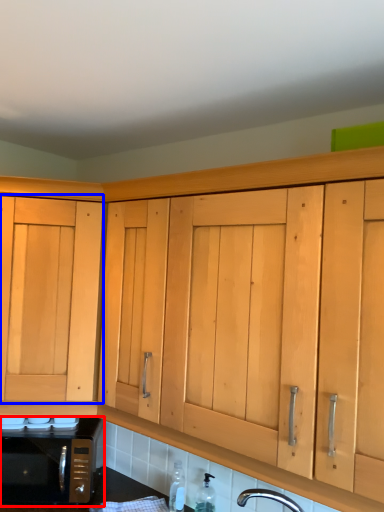
Question: Which point is closer to the camera, microwave oven (highlighted by a red box) or cabinetry (highlighted by a blue box)?

Choices:
 (A) microwave oven
 (B) cabinetry

Answer: (B)